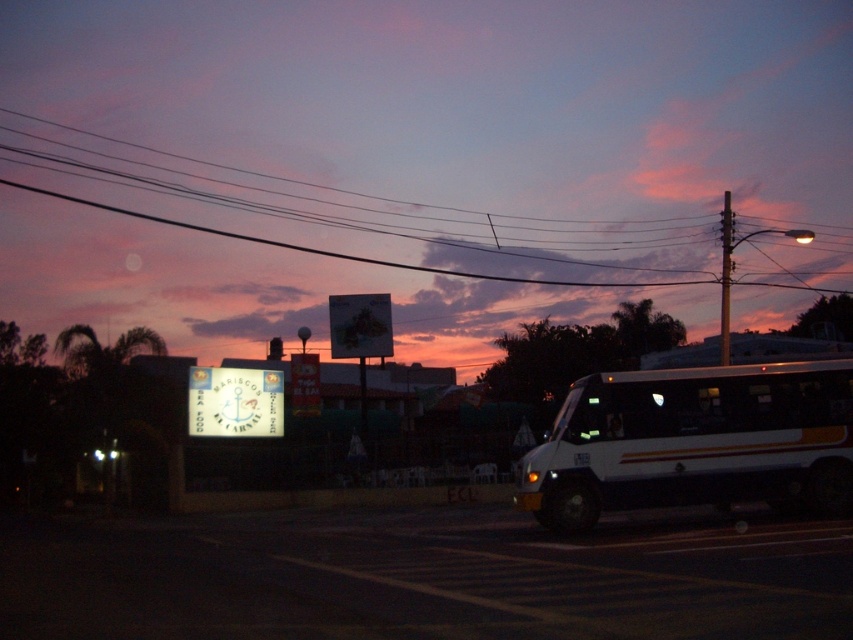
Question: Is matte pink sky at upper center positioned at the back of white matte bus at center?

Choices:
 (A) no
 (B) yes

Answer: (B)

Question: Which point is farther to the camera?

Choices:
 (A) (717, 376)
 (B) (297, 131)

Answer: (B)

Question: Does matte pink sky at upper center appear on the right side of white matte bus at center?

Choices:
 (A) yes
 (B) no

Answer: (B)

Question: Among these objects, which one is farthest from the camera?

Choices:
 (A) matte pink sky at upper center
 (B) white matte bus at center

Answer: (A)

Question: Observing the image, what is the correct spatial positioning of matte pink sky at upper center in reference to white matte bus at center?

Choices:
 (A) left
 (B) right

Answer: (A)